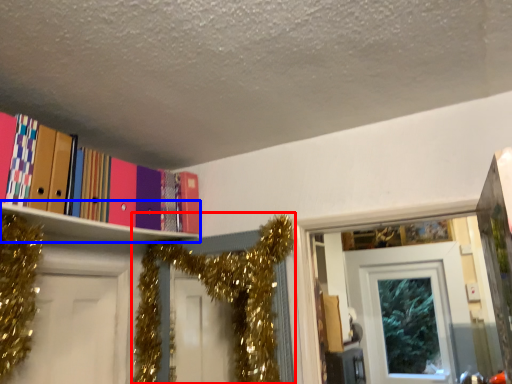
Question: Which point is further to the camera, christmas decoration (highlighted by a red box) or shelf (highlighted by a blue box)?

Choices:
 (A) christmas decoration
 (B) shelf

Answer: (A)